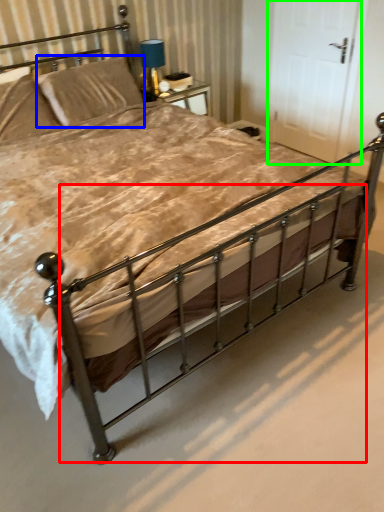
Question: Estimate the real-world distances between objects in this image. Which object is closer to balustrade (highlighted by a red box), pillow (highlighted by a blue box) or door (highlighted by a green box)?

Choices:
 (A) pillow
 (B) door

Answer: (A)